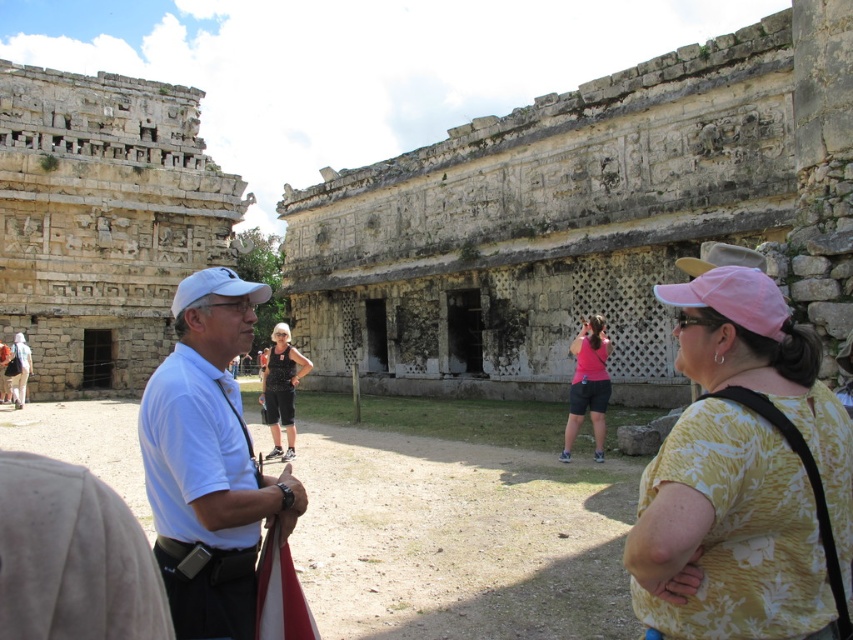
Which of these two, stone textured ruins at left or dark gray shorts at center, stands taller?

Standing taller between the two is stone textured ruins at left.

Which is behind, point (4, 86) or point (280, 339)?

The point (4, 86) is behind.

The height and width of the screenshot is (640, 853). What are the coordinates of `stone textured ruins at left` in the screenshot? It's located at (103, 221).

Where is `weathered stone ruins at center`? Image resolution: width=853 pixels, height=640 pixels. weathered stone ruins at center is located at coordinates (583, 220).

Who is lower down, weathered stone ruins at center or pink fabric at center?

pink fabric at center is below.

Does point (384, 364) come in front of point (604, 404)?

No, (384, 364) is behind (604, 404).

This screenshot has height=640, width=853. What are the coordinates of `weathered stone ruins at center` in the screenshot? It's located at pyautogui.click(x=583, y=220).

Can you confirm if white shirt at center is smaller than white fabric baseball cap at center?

Incorrect, white shirt at center is not smaller in size than white fabric baseball cap at center.

Is point (199, 442) positioned in front of point (241, 291)?

That is True.

Image resolution: width=853 pixels, height=640 pixels. Find the location of `white shirt at center`. white shirt at center is located at coordinates (209, 461).